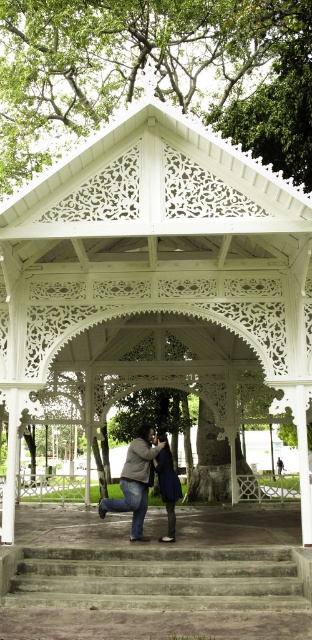
Question: Can you confirm if matte black suit at center is thinner than dark blue fabric dress at center?

Choices:
 (A) yes
 (B) no

Answer: (B)

Question: Can you confirm if white carved wood gazebo at center is positioned below dark blue fabric dress at center?

Choices:
 (A) yes
 (B) no

Answer: (B)

Question: Estimate the real-world distances between objects in this image. Which object is closer to the concrete stairs at lower center?

Choices:
 (A) white carved wood gazebo at center
 (B) dark blue fabric dress at center
 (C) matte black suit at center

Answer: (C)

Question: Estimate the real-world distances between objects in this image. Which object is closer to the concrete stairs at lower center?

Choices:
 (A) dark blue fabric dress at center
 (B) white carved wood gazebo at center
 (C) matte black suit at center

Answer: (C)

Question: Which object appears farthest from the camera in this image?

Choices:
 (A) dark blue fabric dress at center
 (B) white carved wood gazebo at center
 (C) matte black suit at center
 (D) concrete stairs at lower center

Answer: (C)

Question: Can you confirm if concrete stairs at lower center is positioned below dark blue fabric dress at center?

Choices:
 (A) no
 (B) yes

Answer: (B)